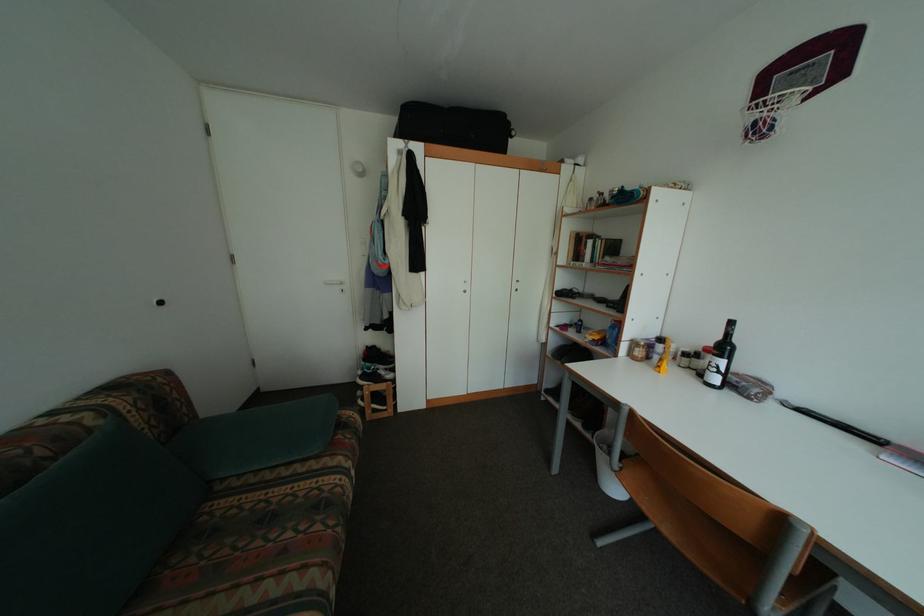
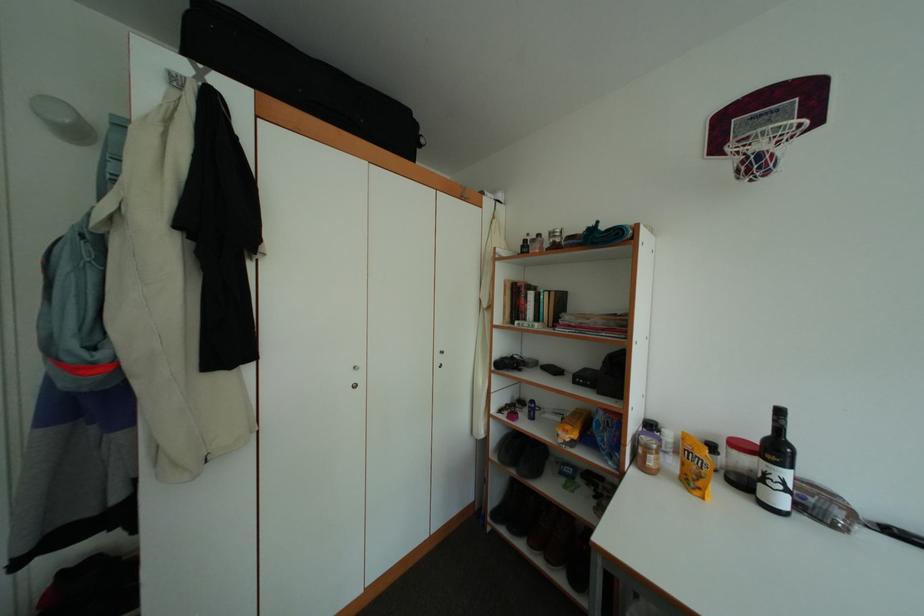
Question: The camera is either moving clockwise (left) or counter-clockwise (right) around the object. The first image is from the beginning of the video and the second image is from the end. Is the camera moving left or right when shooting the video?

Choices:
 (A) Left
 (B) Right

Answer: (A)